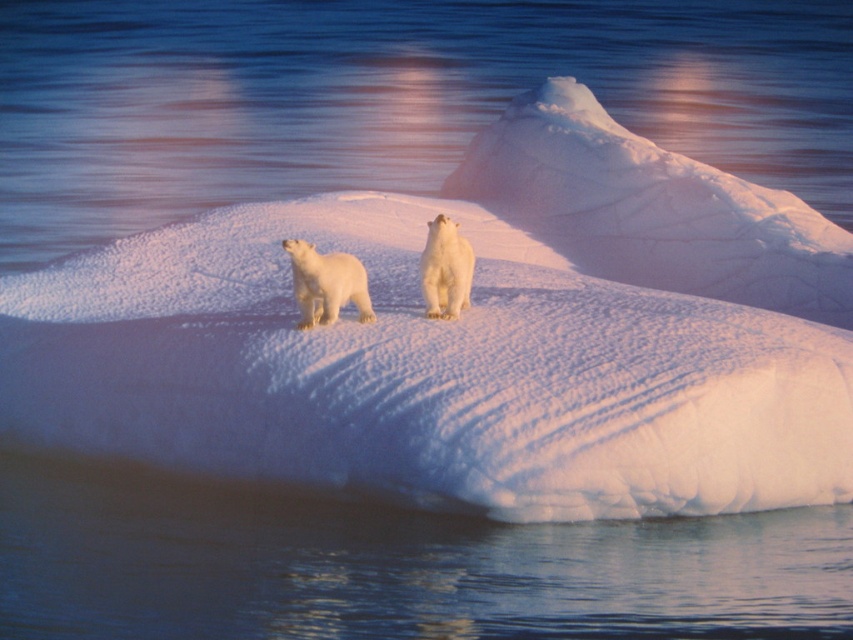
Who is shorter, white fur polar bear at left or white fur bear at center?

Standing shorter between the two is white fur polar bear at left.

Can you confirm if white fur polar bear at left is smaller than white fur bear at center?

No, white fur polar bear at left is not smaller than white fur bear at center.

The image size is (853, 640). Identify the location of white fur polar bear at left. tap(326, 284).

I want to click on white fur polar bear at left, so click(326, 284).